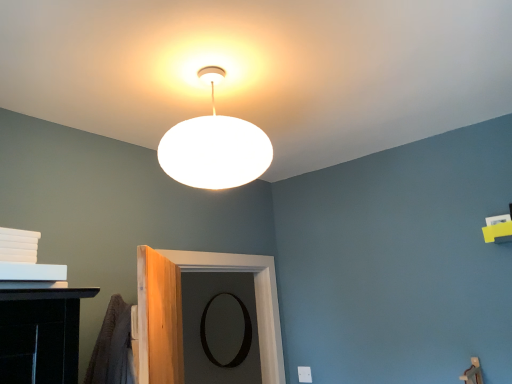
Question: Is white matte lampshade at upper center oriented towards black matte door at center?

Choices:
 (A) no
 (B) yes

Answer: (A)

Question: Considering the relative sizes of white matte lampshade at upper center and black matte door at center in the image provided, is white matte lampshade at upper center bigger than black matte door at center?

Choices:
 (A) no
 (B) yes

Answer: (A)

Question: Is white matte lampshade at upper center at the right side of black matte door at center?

Choices:
 (A) no
 (B) yes

Answer: (B)

Question: From the image's perspective, is white matte lampshade at upper center under black matte door at center?

Choices:
 (A) yes
 (B) no

Answer: (B)

Question: Is white matte lampshade at upper center far from black matte door at center?

Choices:
 (A) yes
 (B) no

Answer: (B)

Question: Relative to black matte mirror at center, is white matte lampshade at upper center in front or behind?

Choices:
 (A) front
 (B) behind

Answer: (A)

Question: From the image's perspective, is white matte lampshade at upper center above or below black matte mirror at center?

Choices:
 (A) below
 (B) above

Answer: (B)

Question: Visually, is white matte lampshade at upper center positioned to the left or to the right of black matte mirror at center?

Choices:
 (A) left
 (B) right

Answer: (B)

Question: Is white matte lampshade at upper center wider or thinner than black matte mirror at center?

Choices:
 (A) wide
 (B) thin

Answer: (A)

Question: Relative to black matte mirror at center, is black matte door at center in front or behind?

Choices:
 (A) front
 (B) behind

Answer: (A)

Question: From the image's perspective, is black matte door at center positioned above or below black matte mirror at center?

Choices:
 (A) above
 (B) below

Answer: (A)

Question: Is black matte door at center wider or thinner than black matte mirror at center?

Choices:
 (A) wide
 (B) thin

Answer: (A)

Question: Considering the relative positions of black matte door at center and black matte mirror at center in the image provided, is black matte door at center to the left or to the right of black matte mirror at center?

Choices:
 (A) right
 (B) left

Answer: (A)

Question: Considering their positions, is white matte lampshade at upper center located in front of or behind black matte door at center?

Choices:
 (A) front
 (B) behind

Answer: (A)

Question: From a real-world perspective, is white matte lampshade at upper center positioned above or below black matte door at center?

Choices:
 (A) above
 (B) below

Answer: (A)